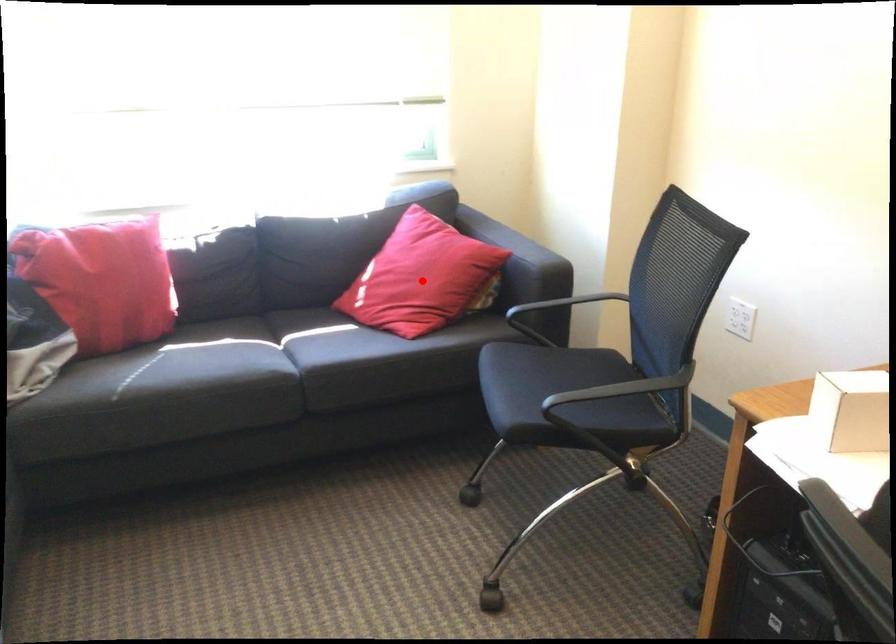
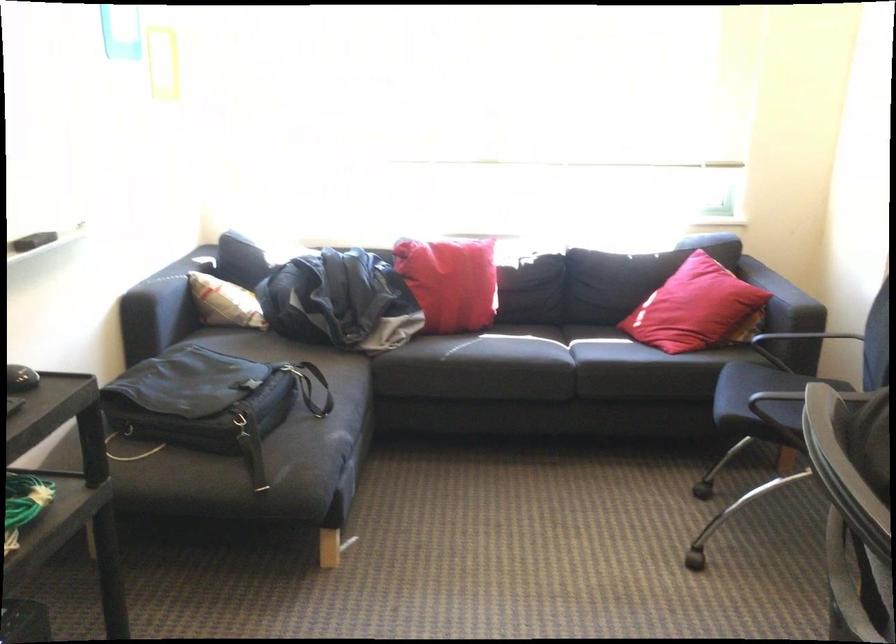
Locate, in the second image, the point that corresponds to the highlighted location in the first image.

(695, 308)